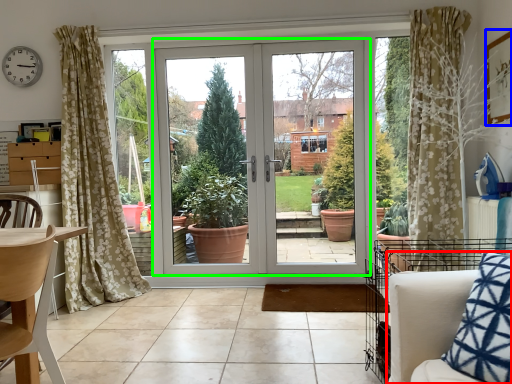
Question: Estimate the real-world distances between objects in this image. Which object is closer to armchair (highlighted by a red box), picture frame (highlighted by a blue box) or door (highlighted by a green box)?

Choices:
 (A) picture frame
 (B) door

Answer: (A)